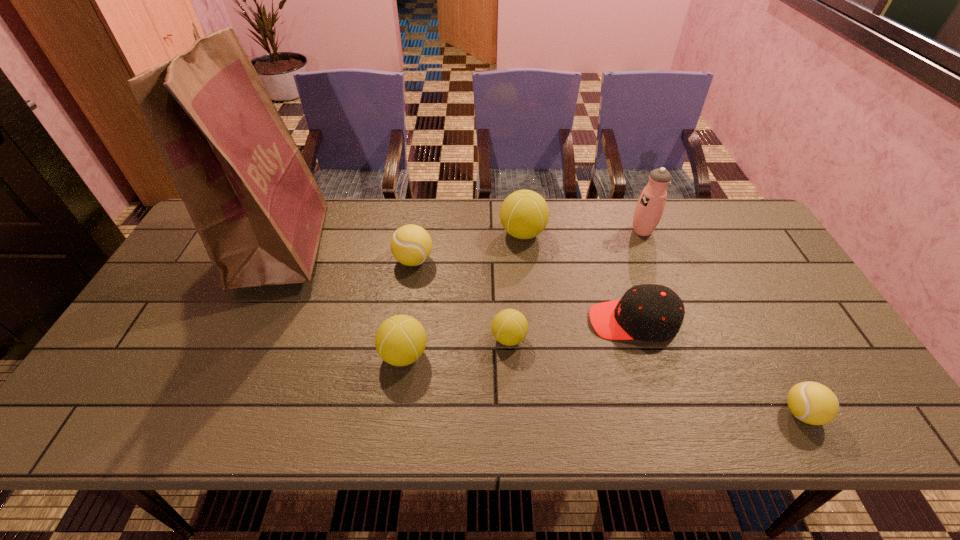
This screenshot has width=960, height=540. In order to click on free point at the far edge in this screenshot , I will do `click(466, 241)`.

At what (x,y) coordinates should I click in order to perform the action: click on vacant space at the near edge of the desktop. Please return your answer as a coordinate pair (x, y). Looking at the image, I should click on (641, 399).

Where is `vacant space at the left edge of the desktop`? vacant space at the left edge of the desktop is located at coordinates (123, 348).

In the image, there is a desktop. Find the location of `vacant space at the right edge`. vacant space at the right edge is located at coordinates (798, 305).

Locate an element on the screen. The height and width of the screenshot is (540, 960). vacant space at the far right corner of the desktop is located at coordinates pyautogui.click(x=758, y=236).

Identify the location of empty space that is in between the bigger yellow tennis ball and the cap. (523, 291).

The height and width of the screenshot is (540, 960). Identify the location of free space that is in between the third tallest object and the thermos bottle. (583, 232).

Identify the location of vacant space in between the tallest object and the rightmost object. The height and width of the screenshot is (540, 960). (542, 329).

Where is `vacant area that lies between the sixth shortest object and the second biggest green tennis ball`? This screenshot has height=540, width=960. vacant area that lies between the sixth shortest object and the second biggest green tennis ball is located at coordinates (464, 294).

Where is `free space between the seventh shortest object and the cap`? The width and height of the screenshot is (960, 540). free space between the seventh shortest object and the cap is located at coordinates tap(637, 276).